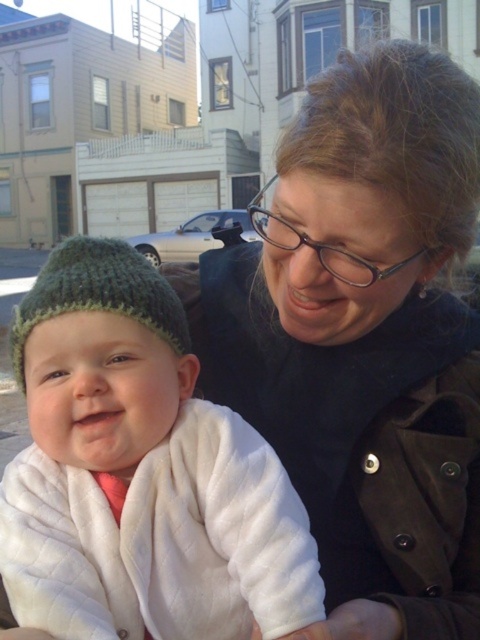
You are standing at the point labeled as point (462, 332) in the image. If you want to move 2 meters forward, will you be able to do so without leaving the scene?

The distance between point (462, 332) and the viewer is 1.02 meters. Since you want to move 2 meters forward from the point, which is beyond the available distance, you cannot move that far without leaving the scene.

You are a photographer trying to capture a photo of the baby and the adult. The baby is wearing a knitted green hat at left and the adult is wearing a matte black jacket at center. Based on their positions, which object is closer to the left side of the image?

The knitted green hat at left is closer to the left side of the image because the matte black jacket at center is positioned to its right.